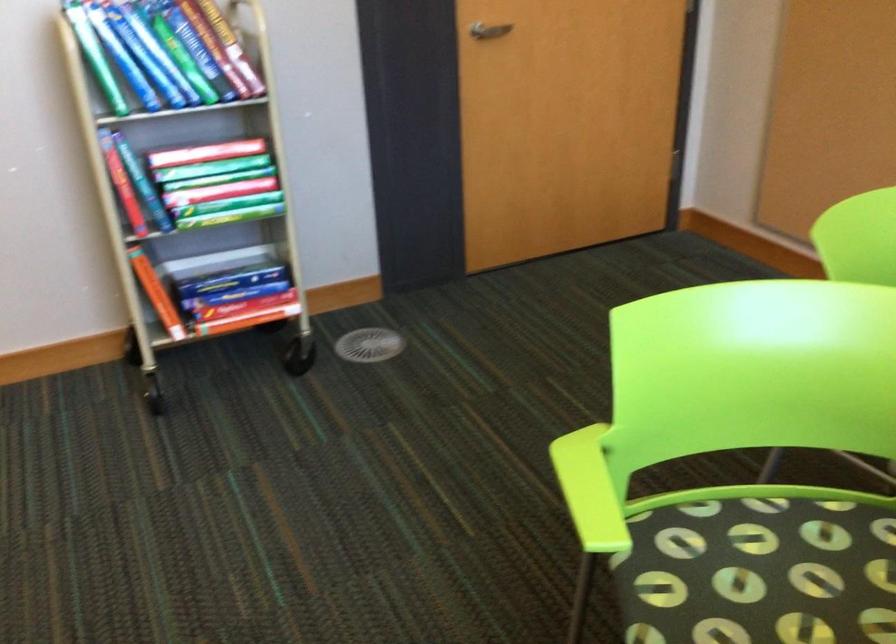
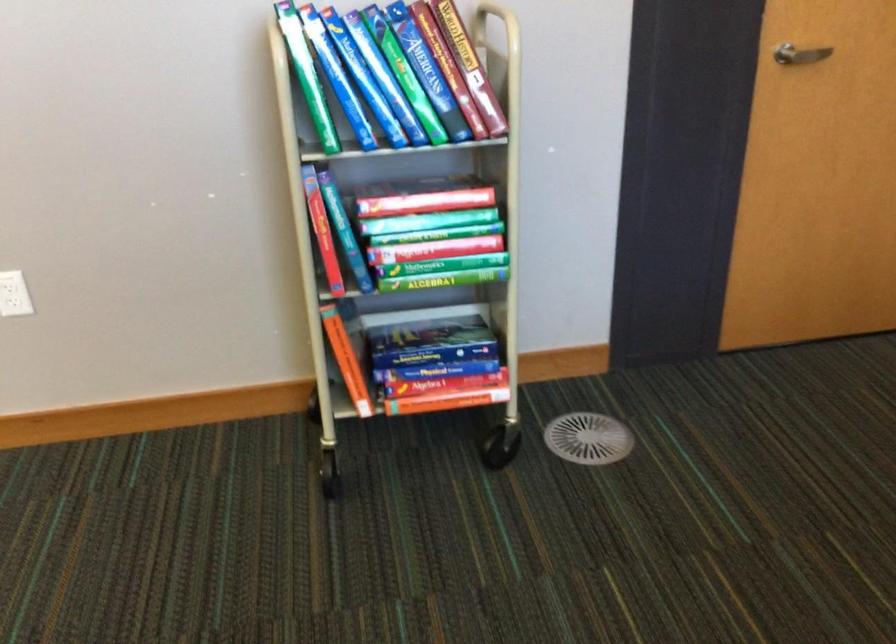
Question: The camera is either moving clockwise (left) or counter-clockwise (right) around the object. The first image is from the beginning of the video and the second image is from the end. Is the camera moving left or right when shooting the video?

Choices:
 (A) Left
 (B) Right

Answer: (B)